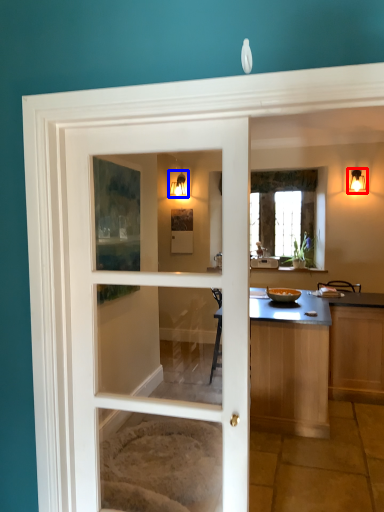
Question: Among these objects, which one is nearest to the camera, light fixture (highlighted by a red box) or light fixture (highlighted by a blue box)?

Choices:
 (A) light fixture
 (B) light fixture

Answer: (A)